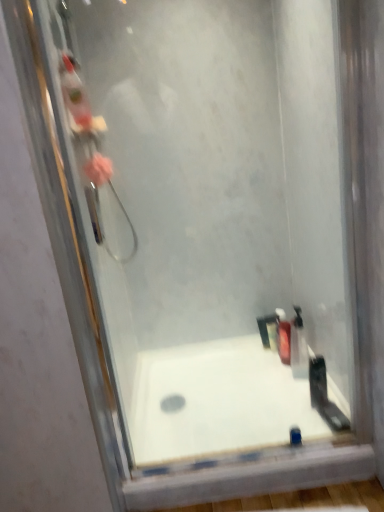
Question: From a real-world perspective, is translucent plastic soap dispenser at lower right, the 3th toiletry when ordered from front to back, below translucent plastic bottle at lower right, which appears as the second toiletry when viewed from the back?

Choices:
 (A) yes
 (B) no

Answer: (A)

Question: From the image's perspective, is translucent plastic soap dispenser at lower right, placed as the first toiletry when sorted from back to front, located above translucent plastic bottle at lower right, which is the second toiletry from front to back?

Choices:
 (A) yes
 (B) no

Answer: (B)

Question: Considering the relative positions of translucent plastic soap dispenser at lower right, the 3th toiletry when ordered from front to back, and translucent plastic bottle at lower right, which is the second toiletry from front to back, in the image provided, is translucent plastic soap dispenser at lower right, the 3th toiletry when ordered from front to back, behind translucent plastic bottle at lower right, which is the second toiletry from front to back,?

Choices:
 (A) no
 (B) yes

Answer: (B)

Question: Is translucent plastic soap dispenser at lower right, placed as the first toiletry when sorted from back to front, beside translucent plastic bottle at lower right, which appears as the second toiletry when viewed from the back?

Choices:
 (A) no
 (B) yes

Answer: (B)

Question: From the image's perspective, is translucent plastic soap dispenser at lower right, placed as the first toiletry when sorted from back to front, below translucent plastic bottle at lower right, which is the second toiletry from front to back?

Choices:
 (A) yes
 (B) no

Answer: (A)

Question: Considering the relative sizes of translucent plastic soap dispenser at lower right, the 3th toiletry when ordered from front to back, and translucent plastic bottle at lower right, which appears as the second toiletry when viewed from the back, in the image provided, is translucent plastic soap dispenser at lower right, the 3th toiletry when ordered from front to back, thinner than translucent plastic bottle at lower right, which appears as the second toiletry when viewed from the back,?

Choices:
 (A) yes
 (B) no

Answer: (B)

Question: From a real-world perspective, does translucent plastic bottle at lower right, which appears as the second toiletry when viewed from the back, sit lower than black plastic razor at right, the third toiletry when ordered from back to front?

Choices:
 (A) no
 (B) yes

Answer: (B)

Question: Can you confirm if translucent plastic bottle at lower right, which appears as the second toiletry when viewed from the back, is shorter than black plastic razor at right, the third toiletry when ordered from back to front?

Choices:
 (A) yes
 (B) no

Answer: (B)

Question: Can you confirm if translucent plastic bottle at lower right, which is the second toiletry from front to back, is bigger than black plastic razor at right, which is the first toiletry in front-to-back order?

Choices:
 (A) no
 (B) yes

Answer: (B)

Question: From the image's perspective, is translucent plastic bottle at lower right, which is the second toiletry from front to back, below black plastic razor at right, which is the first toiletry in front-to-back order?

Choices:
 (A) no
 (B) yes

Answer: (A)

Question: Is translucent plastic bottle at lower right, which appears as the second toiletry when viewed from the back, closer to camera compared to black plastic razor at right, which is the first toiletry in front-to-back order?

Choices:
 (A) no
 (B) yes

Answer: (A)

Question: Considering the relative positions of translucent plastic bottle at lower right, which is the second toiletry from front to back, and black plastic razor at right, the third toiletry when ordered from back to front, in the image provided, is translucent plastic bottle at lower right, which is the second toiletry from front to back, to the right of black plastic razor at right, the third toiletry when ordered from back to front, from the viewer's perspective?

Choices:
 (A) yes
 (B) no

Answer: (A)

Question: Can you confirm if black plastic razor at right, which is the first toiletry in front-to-back order, is taller than translucent plastic bottle at lower right, which is the second toiletry from front to back?

Choices:
 (A) yes
 (B) no

Answer: (B)